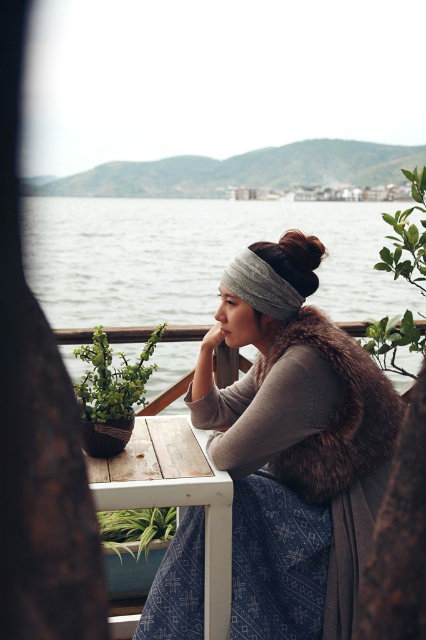
You are a guest at this balcony and want to place a small vase between the fuzzy brown vest at center and the green leafy plant at center. Based on their positions, where should you place the vase so it is between them?

The fuzzy brown vest at center is positioned under the green leafy plant at center, so to place the vase between them, you should position it directly below the green leafy plant at center and above the fuzzy brown vest at center.

You are a guest at this balcony and want to place a small vase between the fuzzy brown vest at center and the green leafy plant at right. Based on their positions, where should you place the vase so it is between them?

The fuzzy brown vest at center is positioned under the green leafy plant at right, so to place the vase between them, you should position it horizontally between the two objects, ensuring it is not directly below or above either one.